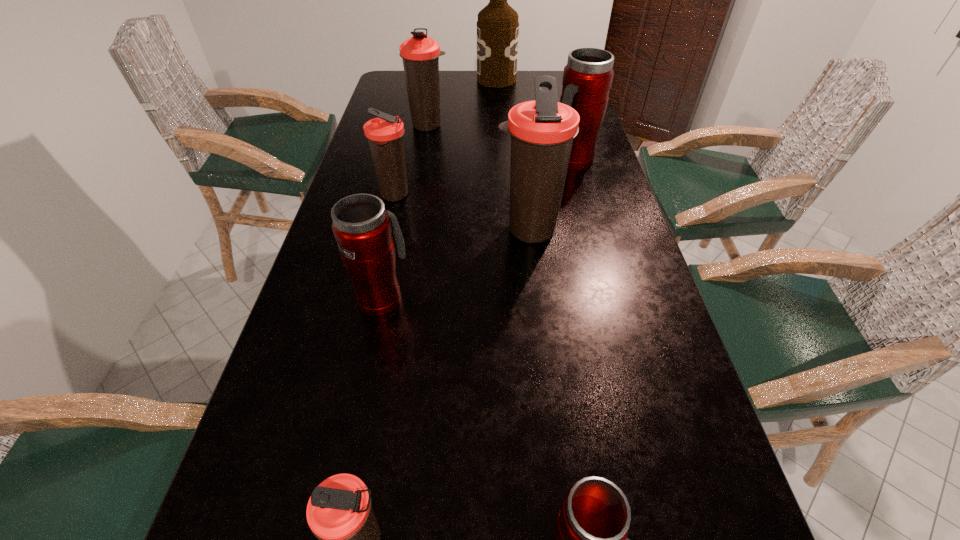
Find the location of `the farthest object`. the farthest object is located at coordinates (497, 27).

Locate an element on the screen. alcohol is located at coordinates (497, 27).

In order to click on the rightmost brown thermos bottle in this screenshot , I will do `click(542, 131)`.

Identify the location of the second nearest brown thermos bottle. (542, 131).

Identify the location of the second biggest brown thermos bottle. (420, 54).

Image resolution: width=960 pixels, height=540 pixels. Find the location of `the second farthest object`. the second farthest object is located at coordinates (420, 54).

Locate an element on the screen. This screenshot has width=960, height=540. the farthest red thermos bottle is located at coordinates (587, 78).

Locate an element on the screen. This screenshot has height=540, width=960. the second farthest thermos bottle is located at coordinates (587, 78).

Where is `the second smallest brown thermos bottle`? The height and width of the screenshot is (540, 960). the second smallest brown thermos bottle is located at coordinates (384, 134).

Locate an element on the screen. the fifth nearest object is located at coordinates (384, 134).